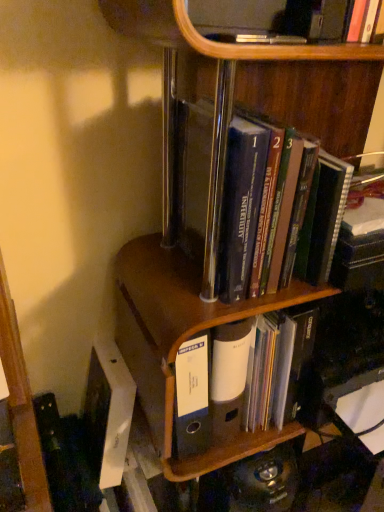
Question: Considering the relative sizes of white matte file folder at center, the second book positioned from the top, and brown wood file at center in the image provided, is white matte file folder at center, the second book positioned from the top, taller than brown wood file at center?

Choices:
 (A) no
 (B) yes

Answer: (A)

Question: Can you confirm if white matte file folder at center, the second book positioned from the top, is bigger than brown wood file at center?

Choices:
 (A) yes
 (B) no

Answer: (B)

Question: Considering the relative sizes of white matte file folder at center, the first book positioned from the bottom, and brown wood file at center in the image provided, is white matte file folder at center, the first book positioned from the bottom, smaller than brown wood file at center?

Choices:
 (A) no
 (B) yes

Answer: (B)

Question: From a real-world perspective, is white matte file folder at center, the second book positioned from the top, located beneath brown wood file at center?

Choices:
 (A) yes
 (B) no

Answer: (A)

Question: Is white matte file folder at center, the first book positioned from the bottom, thinner than brown wood file at center?

Choices:
 (A) no
 (B) yes

Answer: (B)

Question: From a real-world perspective, is white matte file folder at center, the second book positioned from the top, above or below hardcover books at center, which appears as the second book when ordered from the bottom?

Choices:
 (A) above
 (B) below

Answer: (B)

Question: Is white matte file folder at center, the second book positioned from the top, in front of or behind hardcover books at center, which appears as the second book when ordered from the bottom, in the image?

Choices:
 (A) front
 (B) behind

Answer: (B)

Question: In terms of width, does white matte file folder at center, the first book positioned from the bottom, look wider or thinner when compared to hardcover books at center, the first book in the top-to-bottom sequence?

Choices:
 (A) wide
 (B) thin

Answer: (B)

Question: Is point (279, 430) closer or farther from the camera than point (253, 154)?

Choices:
 (A) farther
 (B) closer

Answer: (A)

Question: From the image's perspective, is white matte file folder at center, the first book positioned from the bottom, above or below brown wood file at center?

Choices:
 (A) above
 (B) below

Answer: (B)

Question: Looking at the image, does white matte file folder at center, the first book positioned from the bottom, seem bigger or smaller compared to brown wood file at center?

Choices:
 (A) small
 (B) big

Answer: (A)

Question: From a real-world perspective, relative to brown wood file at center, is white matte file folder at center, the second book positioned from the top, vertically above or below?

Choices:
 (A) below
 (B) above

Answer: (A)

Question: Considering the positions of white matte file folder at center, the first book positioned from the bottom, and brown wood file at center in the image, is white matte file folder at center, the first book positioned from the bottom, taller or shorter than brown wood file at center?

Choices:
 (A) tall
 (B) short

Answer: (B)

Question: Does point (192, 430) appear closer or farther from the camera than point (279, 179)?

Choices:
 (A) closer
 (B) farther

Answer: (B)

Question: In terms of width, does brown wood file at center look wider or thinner when compared to hardcover books at center, which appears as the second book when ordered from the bottom?

Choices:
 (A) thin
 (B) wide

Answer: (B)